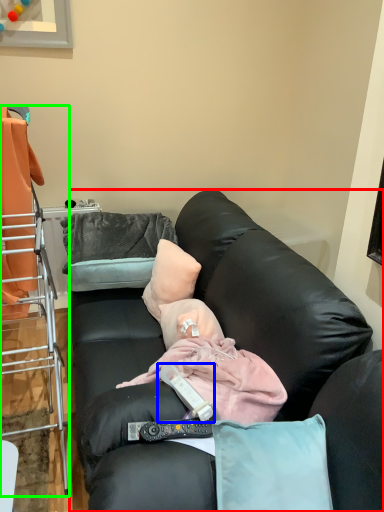
Question: Which object is positioned farthest from studio couch (highlighted by a red box)? Select from remote control (highlighted by a blue box) and cabinetry (highlighted by a green box).

Choices:
 (A) remote control
 (B) cabinetry

Answer: (B)